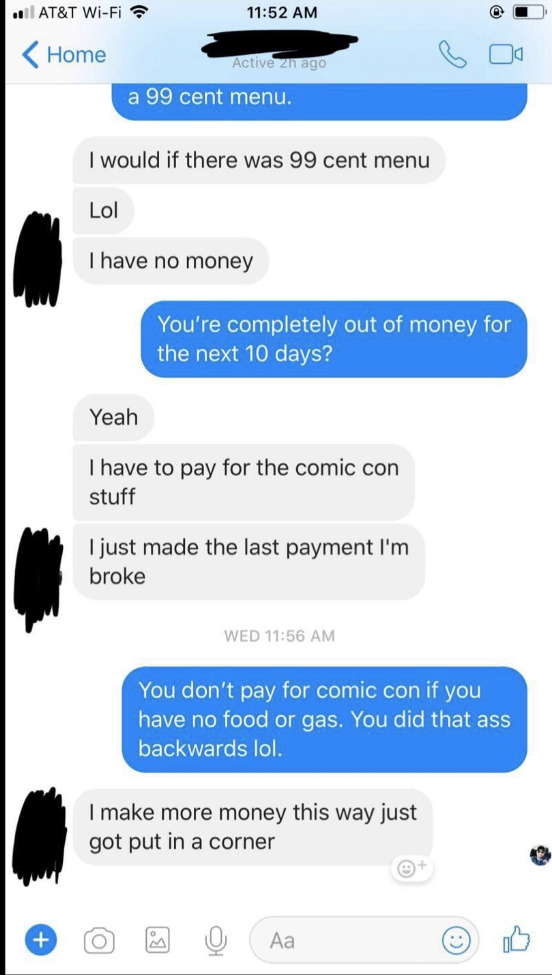
Locate an element on the screen. call button is located at coordinates (453, 60).